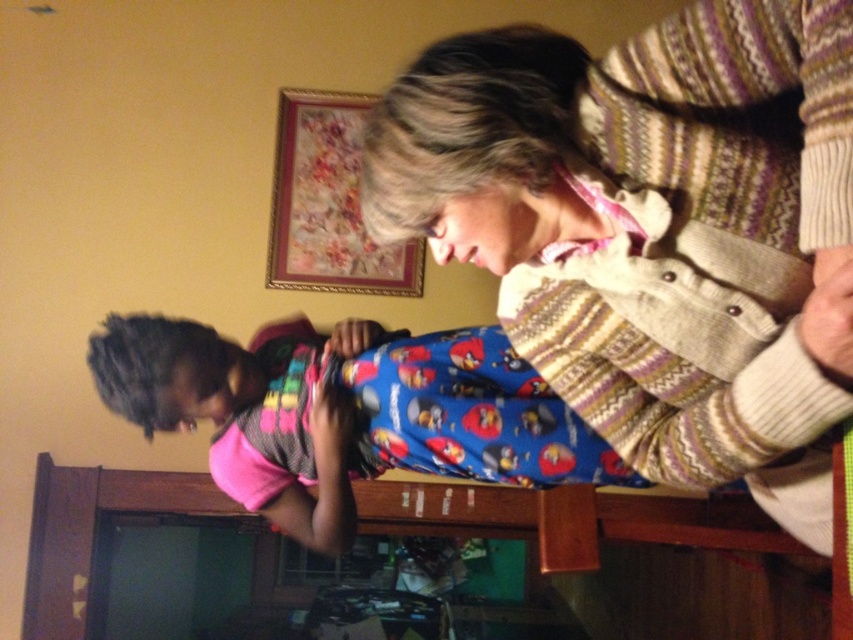
Does point (724, 3) come farther from viewer compared to point (286, 397)?

No, it is not.

Looking at this image, between striped knit sweater at upper right and blue cotton pajama at center, which one has more height?

striped knit sweater at upper right

Find the location of `striped knit sweater at upper right`. striped knit sweater at upper right is located at coordinates (653, 228).

You are a GUI agent. You are given a task and a screenshot of the screen. Output one action in this format:
    pyautogui.click(x=<x>, y=<y>)
    Task: Click on the striped knit sweater at upper right
    
    Given the screenshot: What is the action you would take?
    click(x=653, y=228)